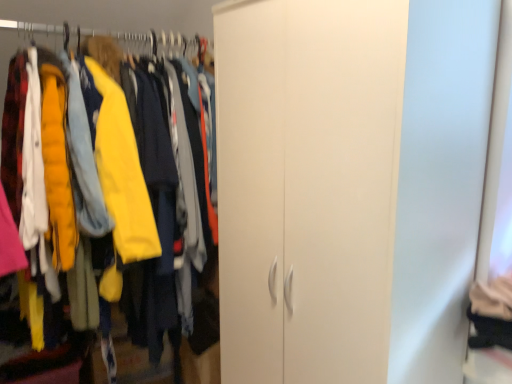
Question: From a real-world perspective, does yellow fabric hanger at upper left sit lower than white matte cabinet at center?

Choices:
 (A) no
 (B) yes

Answer: (A)

Question: Is yellow fabric hanger at upper left taller than white matte cabinet at center?

Choices:
 (A) no
 (B) yes

Answer: (A)

Question: Considering the relative sizes of yellow fabric hanger at upper left and white matte cabinet at center in the image provided, is yellow fabric hanger at upper left thinner than white matte cabinet at center?

Choices:
 (A) yes
 (B) no

Answer: (A)

Question: Would you say yellow fabric hanger at upper left contains white matte cabinet at center?

Choices:
 (A) no
 (B) yes

Answer: (A)

Question: Does yellow fabric hanger at upper left appear on the left side of white matte cabinet at center?

Choices:
 (A) no
 (B) yes

Answer: (B)

Question: Does yellow fabric hanger at upper left lie in front of white matte cabinet at center?

Choices:
 (A) no
 (B) yes

Answer: (A)

Question: Does white matte cabinet at center touch yellow fabric hanger at upper left?

Choices:
 (A) yes
 (B) no

Answer: (B)

Question: Is white matte cabinet at center wider than yellow fabric hanger at upper left?

Choices:
 (A) yes
 (B) no

Answer: (A)

Question: From the image's perspective, is white matte cabinet at center on yellow fabric hanger at upper left?

Choices:
 (A) yes
 (B) no

Answer: (B)

Question: Is white matte cabinet at center not inside yellow fabric hanger at upper left?

Choices:
 (A) no
 (B) yes

Answer: (B)

Question: Considering the relative sizes of white matte cabinet at center and yellow fabric hanger at upper left in the image provided, is white matte cabinet at center smaller than yellow fabric hanger at upper left?

Choices:
 (A) no
 (B) yes

Answer: (A)

Question: Is white matte cabinet at center closer to camera compared to yellow fabric hanger at upper left?

Choices:
 (A) yes
 (B) no

Answer: (A)

Question: Considering their positions, is yellow fabric hanger at upper left located in front of or behind white matte cabinet at center?

Choices:
 (A) behind
 (B) front

Answer: (A)